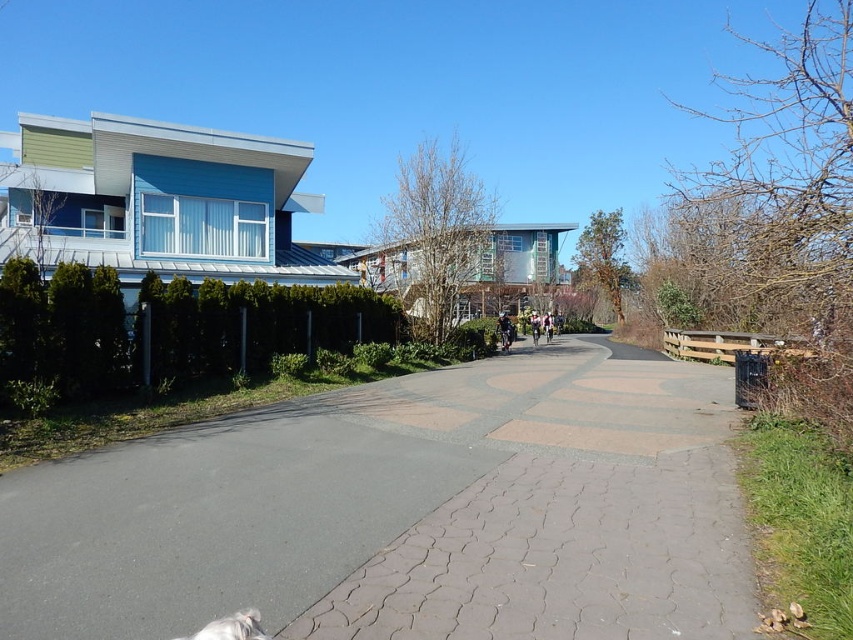
Does point (254, 536) come in front of point (553, 326)?

Yes, it is.

Is paved concrete at center to the left of light blue fabric jacket at center from the viewer's perspective?

Indeed, paved concrete at center is positioned on the left side of light blue fabric jacket at center.

Is point (183, 490) in front of point (549, 324)?

That is True.

Where is `paved concrete at center`? This screenshot has height=640, width=853. paved concrete at center is located at coordinates (405, 513).

The height and width of the screenshot is (640, 853). Identify the location of paved concrete at center. (405, 513).

Does paved concrete at center have a larger size compared to white fur dog at lower left?

Yes, paved concrete at center is bigger than white fur dog at lower left.

Is point (358, 449) closer to camera compared to point (242, 620)?

No, (358, 449) is behind (242, 620).

The height and width of the screenshot is (640, 853). I want to click on paved concrete at center, so click(405, 513).

Does dark blue jacket at center appear on the left side of light blue fabric jacket at center?

Yes, dark blue jacket at center is to the left of light blue fabric jacket at center.

Can you confirm if dark blue jacket at center is taller than light blue fabric jacket at center?

Indeed, dark blue jacket at center has a greater height compared to light blue fabric jacket at center.

Between point (506, 348) and point (549, 333), which one is positioned behind?

Point (549, 333)

Where is `dark blue jacket at center`? The width and height of the screenshot is (853, 640). dark blue jacket at center is located at coordinates (503, 330).